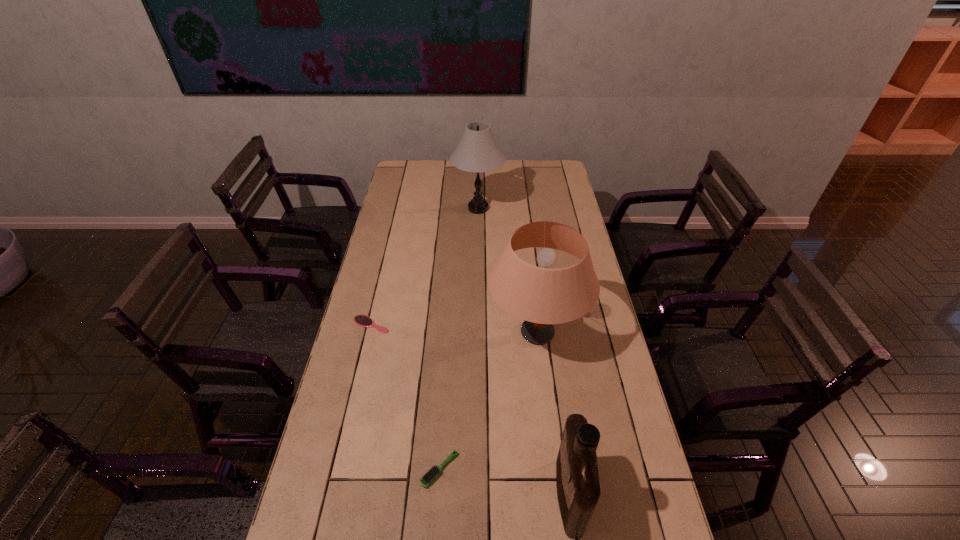
At what (x,y) coordinates should I click in order to perform the action: click on lamp. Please return your answer as a coordinate pair (x, y). The image size is (960, 540). Looking at the image, I should click on (477, 151).

The width and height of the screenshot is (960, 540). I want to click on lampshade, so click(x=542, y=296).

Locate an element on the screen. Image resolution: width=960 pixels, height=540 pixels. liquor is located at coordinates (577, 478).

Where is `the nearer hairbrush`? the nearer hairbrush is located at coordinates (436, 470).

In order to click on the taller hairbrush in this screenshot , I will do `click(436, 470)`.

Where is `the shorter hairbrush`? The width and height of the screenshot is (960, 540). the shorter hairbrush is located at coordinates (362, 320).

Where is `the farther hairbrush`? the farther hairbrush is located at coordinates (362, 320).

This screenshot has height=540, width=960. What are the coordinates of `vacant space located on the back of the farthest object` in the screenshot? It's located at (478, 168).

The image size is (960, 540). I want to click on vacant space situated 0.370m on the front-facing side of the lampshade, so click(380, 333).

Locate an element on the screen. The image size is (960, 540). blank area located 0.220m on the front-facing side of the lampshade is located at coordinates [x=423, y=333].